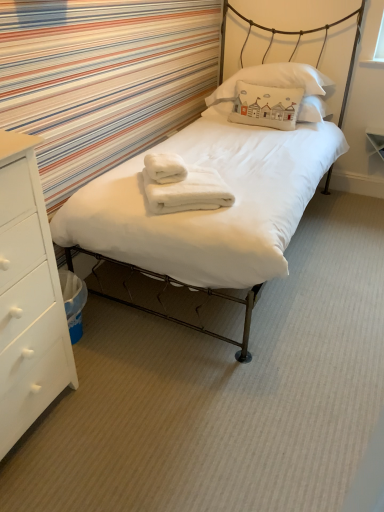
I want to click on free point in front of white fluffy bath towel at center, placed as the 2th bath towel when sorted from bottom to top, so click(179, 184).